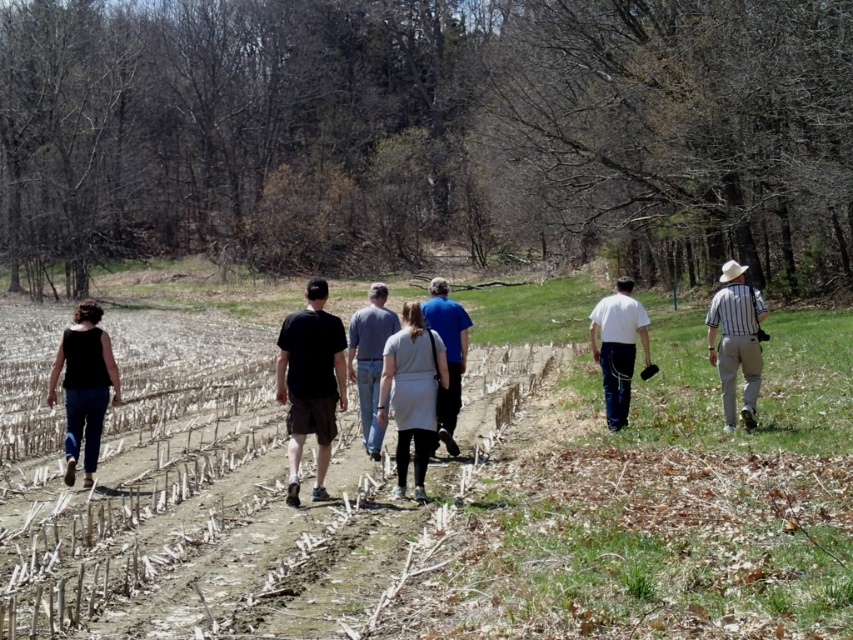
Question: Considering the real-world distances, which object is farthest from the black fabric pants at left?

Choices:
 (A) blue cotton shirt at center
 (B) light gray dress at center
 (C) black cotton shorts at center

Answer: (A)

Question: Which point is closer to the camera?

Choices:
 (A) light gray dress at center
 (B) white striped shirt at right
 (C) blue cotton shirt at center
 (D) gray cotton shirt at center

Answer: (A)

Question: Does black fabric pants at left have a greater width compared to gray cotton shirt at center?

Choices:
 (A) yes
 (B) no

Answer: (A)

Question: Is brown dirt path at center further to the viewer compared to white matte shirt at center?

Choices:
 (A) yes
 (B) no

Answer: (B)

Question: Among these points, which one is farthest from the camera?

Choices:
 (A) (625, 337)
 (B) (401, 317)
 (C) (397, 320)

Answer: (A)

Question: Is light gray dress at center bigger than blue cotton shirt at center?

Choices:
 (A) no
 (B) yes

Answer: (A)